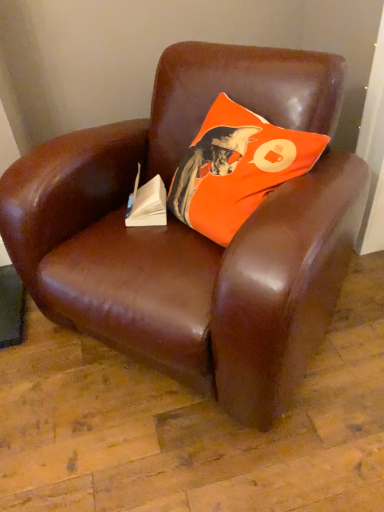
Question: Is orange fabric pillow at upper center shorter than white paper at center?

Choices:
 (A) yes
 (B) no

Answer: (B)

Question: Is orange fabric pillow at upper center thinner than white paper at center?

Choices:
 (A) yes
 (B) no

Answer: (B)

Question: Can you confirm if orange fabric pillow at upper center is wider than white paper at center?

Choices:
 (A) no
 (B) yes

Answer: (B)

Question: Considering the relative positions of orange fabric pillow at upper center and white paper at center in the image provided, is orange fabric pillow at upper center to the left of white paper at center from the viewer's perspective?

Choices:
 (A) yes
 (B) no

Answer: (B)

Question: Is orange fabric pillow at upper center aimed at white paper at center?

Choices:
 (A) no
 (B) yes

Answer: (B)

Question: From the image's perspective, is orange fabric pillow at upper center located above white paper at center?

Choices:
 (A) yes
 (B) no

Answer: (A)

Question: Is white paper at center wider than orange fabric pillow at upper center?

Choices:
 (A) yes
 (B) no

Answer: (B)

Question: Considering the relative sizes of white paper at center and orange fabric pillow at upper center in the image provided, is white paper at center taller than orange fabric pillow at upper center?

Choices:
 (A) no
 (B) yes

Answer: (A)

Question: Can you confirm if white paper at center is smaller than orange fabric pillow at upper center?

Choices:
 (A) yes
 (B) no

Answer: (A)

Question: From the image's perspective, would you say white paper at center is shown under orange fabric pillow at upper center?

Choices:
 (A) yes
 (B) no

Answer: (A)

Question: Is white paper at center not close to orange fabric pillow at upper center?

Choices:
 (A) yes
 (B) no

Answer: (B)

Question: Can you confirm if white paper at center is positioned to the left of orange fabric pillow at upper center?

Choices:
 (A) no
 (B) yes

Answer: (B)

Question: Is orange fabric pillow at upper center positioned in front of brown leather chair at center?

Choices:
 (A) yes
 (B) no

Answer: (B)